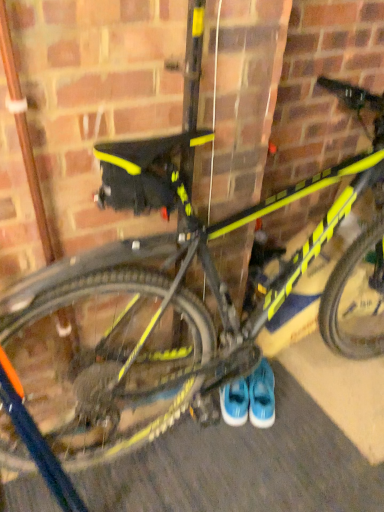
Locate an element on the screen. vacant area that is in front of blue suede sneakers at center, which is the first footwear in left-to-right order is located at coordinates (230, 435).